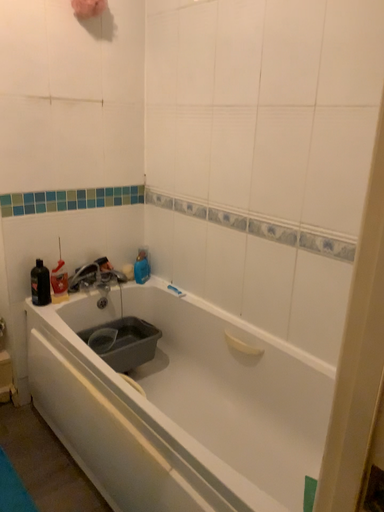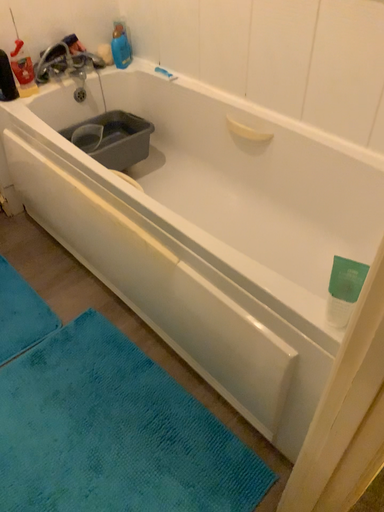
Question: Which way did the camera rotate in the video?

Choices:
 (A) rotated upward
 (B) rotated downward

Answer: (B)